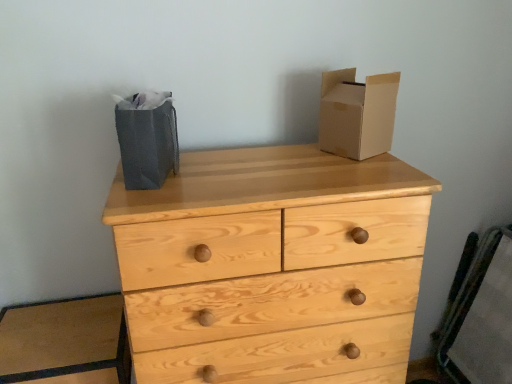
Locate an element on the screen. space that is in front of gray paper bag at left is located at coordinates (159, 191).